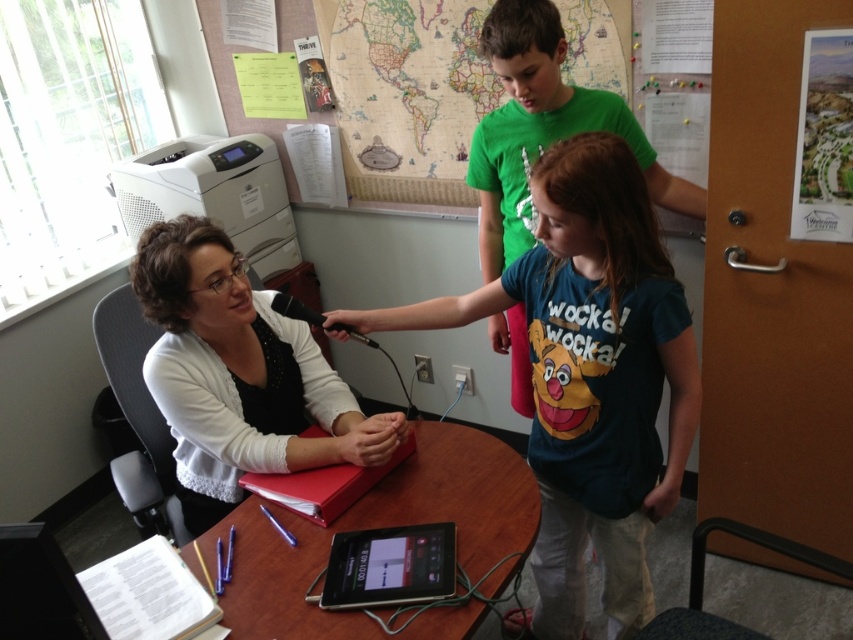
Question: Which point is closer to the camera?

Choices:
 (A) black glossy tablet at center
 (B) blue cotton shirt at center

Answer: (B)

Question: From the image, what is the correct spatial relationship of blue cotton shirt at center in relation to white matte shirt at center?

Choices:
 (A) below
 (B) above

Answer: (A)

Question: Can you confirm if wooden table at center is positioned below paper map at upper center?

Choices:
 (A) yes
 (B) no

Answer: (A)

Question: Which object is the farthest from the paper map at upper center?

Choices:
 (A) black glossy tablet at center
 (B) wooden table at center

Answer: (A)

Question: Among these objects, which one is nearest to the camera?

Choices:
 (A) green cotton shirt at upper center
 (B) black glossy tablet at center

Answer: (B)

Question: Observing the image, what is the correct spatial positioning of blue cotton shirt at center in reference to black glossy tablet at center?

Choices:
 (A) below
 (B) above

Answer: (B)